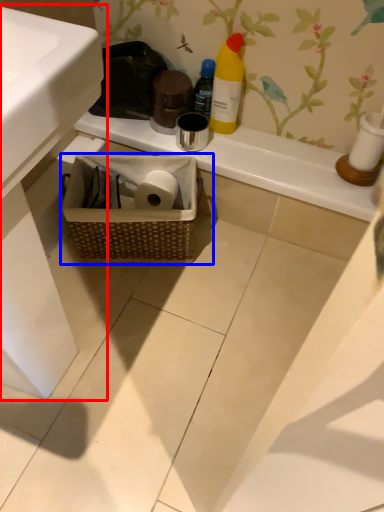
Question: Among these objects, which one is nearest to the camera, sink (highlighted by a red box) or picnic basket (highlighted by a blue box)?

Choices:
 (A) sink
 (B) picnic basket

Answer: (A)